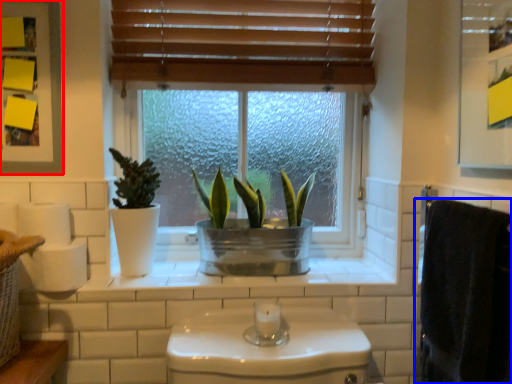
Question: Among these objects, which one is nearest to the camera, medicine cabinet (highlighted by a red box) or bath towel (highlighted by a blue box)?

Choices:
 (A) medicine cabinet
 (B) bath towel

Answer: (B)